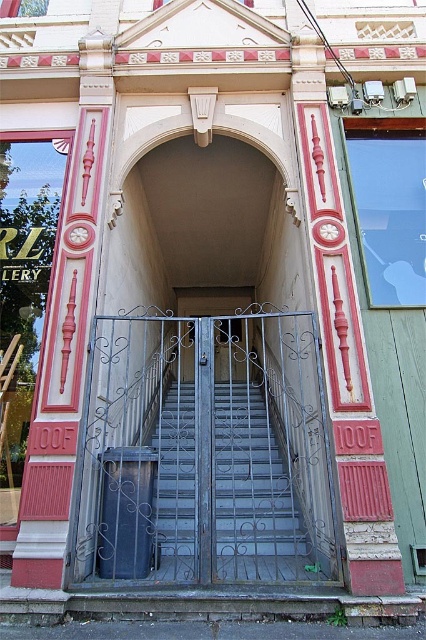
You are a delivery person trying to enter the building. You see the metallic gray stairs at center and the metallic gray gate at center. Which one should you use to access the entrance?

The metallic gray stairs at center is larger in size compared to the metallic gray gate at center, so you should use the metallic gray stairs at center to access the entrance.

You are a delivery person approaching the entrance of the building. You see the dark gray wrought iron gate at center and the metallic gray stairs at center. Which object is positioned higher from the ground?

The dark gray wrought iron gate at center is above metallic gray stairs at center, so the dark gray wrought iron gate at center is higher from the ground.

You are standing in front of the building entrance and want to enter. There is a metallic gray stairs at center and a metallic gray gate at center. Which one should you approach first to enter the building?

The metallic gray stairs at center is in front of the metallic gray gate at center, so you should approach the metallic gray stairs at center first to enter the building.